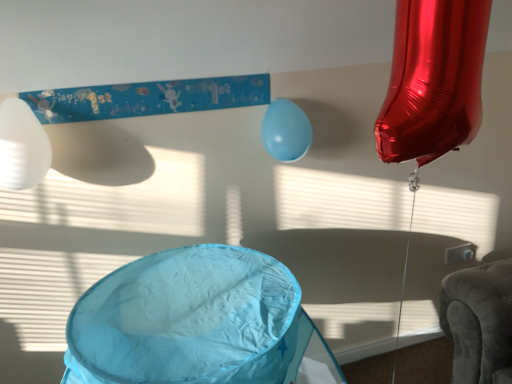
Question: Which direction should I rotate to look at light blue rubber balloon at center, acting as the 2th balloon starting from the front?

Choices:
 (A) right
 (B) left

Answer: (A)

Question: Considering the relative sizes of light blue rubber balloon at center, positioned as the 1th balloon in back-to-front order, and white matte balloon at left, which is the 2th balloon in back-to-front order, in the image provided, is light blue rubber balloon at center, positioned as the 1th balloon in back-to-front order, thinner than white matte balloon at left, which is the 2th balloon in back-to-front order,?

Choices:
 (A) yes
 (B) no

Answer: (A)

Question: Is light blue rubber balloon at center, positioned as the 1th balloon in back-to-front order, wider than white matte balloon at left, positioned as the 1th balloon in front-to-back order?

Choices:
 (A) yes
 (B) no

Answer: (B)

Question: From a real-world perspective, is light blue rubber balloon at center, the 2th balloon viewed from the left, over white matte balloon at left, which is the 2th balloon in back-to-front order?

Choices:
 (A) no
 (B) yes

Answer: (A)

Question: Does light blue rubber balloon at center, positioned as the 1th balloon in back-to-front order, come in front of white matte balloon at left, which is the 2th balloon in back-to-front order?

Choices:
 (A) yes
 (B) no

Answer: (B)

Question: Considering the relative positions of light blue rubber balloon at center, positioned as the 1th balloon in back-to-front order, and white matte balloon at left, positioned as the 1th balloon in front-to-back order, in the image provided, is light blue rubber balloon at center, positioned as the 1th balloon in back-to-front order, to the right of white matte balloon at left, positioned as the 1th balloon in front-to-back order, from the viewer's perspective?

Choices:
 (A) no
 (B) yes

Answer: (B)

Question: From the image's perspective, is light blue rubber balloon at center, positioned as the 1th balloon in back-to-front order, above white matte balloon at left, acting as the 2th balloon starting from the right?

Choices:
 (A) no
 (B) yes

Answer: (B)

Question: Is white matte balloon at left, positioned as the 1th balloon in front-to-back order, not close to light blue rubber balloon at center, positioned as the 1th balloon in back-to-front order?

Choices:
 (A) yes
 (B) no

Answer: (B)

Question: Is white matte balloon at left, positioned as the 1th balloon in front-to-back order, turned away from light blue rubber balloon at center, the first balloon positioned from the right?

Choices:
 (A) yes
 (B) no

Answer: (B)

Question: Does white matte balloon at left, which is the 2th balloon in back-to-front order, lie in front of light blue rubber balloon at center, acting as the 2th balloon starting from the front?

Choices:
 (A) no
 (B) yes

Answer: (B)

Question: Does white matte balloon at left, acting as the 2th balloon starting from the right, have a larger size compared to light blue rubber balloon at center, the 2th balloon viewed from the left?

Choices:
 (A) yes
 (B) no

Answer: (A)

Question: Is white matte balloon at left, the 1th balloon in the left-to-right sequence, smaller than light blue rubber balloon at center, acting as the 2th balloon starting from the front?

Choices:
 (A) yes
 (B) no

Answer: (B)

Question: Would you say white matte balloon at left, positioned as the 1th balloon in front-to-back order, is outside light blue rubber balloon at center, the first balloon positioned from the right?

Choices:
 (A) yes
 (B) no

Answer: (A)

Question: Looking at the image, does white matte balloon at left, which is the 2th balloon in back-to-front order, seem bigger or smaller compared to light blue rubber balloon at center, positioned as the 1th balloon in back-to-front order?

Choices:
 (A) small
 (B) big

Answer: (B)